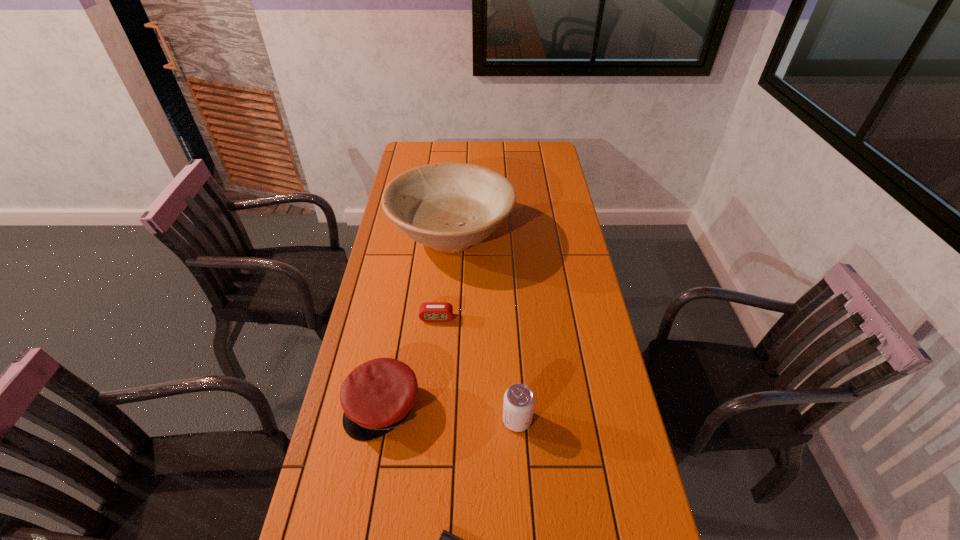
This screenshot has height=540, width=960. I want to click on empty space that is in between the third tallest object and the tallest object, so (x=418, y=321).

Where is `free space between the second tallest object and the tallest object`? Image resolution: width=960 pixels, height=540 pixels. free space between the second tallest object and the tallest object is located at coordinates (484, 328).

Find the location of `blank region between the soda can and the dish`. blank region between the soda can and the dish is located at coordinates (484, 328).

The width and height of the screenshot is (960, 540). Find the location of `free spot between the third shortest object and the tallest object`. free spot between the third shortest object and the tallest object is located at coordinates (418, 321).

This screenshot has height=540, width=960. I want to click on free point between the second farthest object and the soda can, so click(x=477, y=369).

Locate which object is the third closest to the dish. Please provide its 2D coordinates. Your answer should be formatted as a tuple, i.e. [(x, y)], where the tuple contains the x and y coordinates of a point satisfying the conditions above.

[(519, 400)]

Select which object appears as the closest to the nearest object. Please provide its 2D coordinates. Your answer should be formatted as a tuple, i.e. [(x, y)], where the tuple contains the x and y coordinates of a point satisfying the conditions above.

[(377, 396)]

Find the location of a particular element. free space that satisfies the following two spatial constraints: 1. at the front of the cap where the visor is located; 2. on the left side of the soda can is located at coordinates (381, 420).

Identify the location of free region that satisfies the following two spatial constraints: 1. on the front-facing side of the soda can; 2. on the left side of the fourth tallest object. (427, 420).